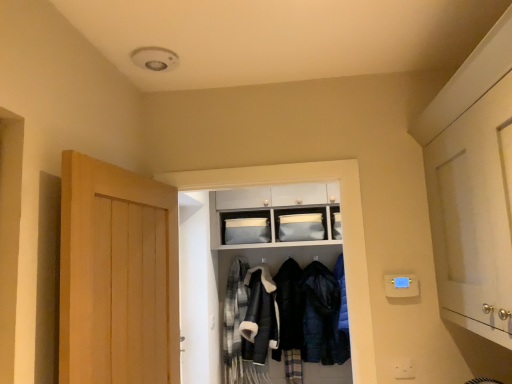
Question: Does light brown wooden door at left, the 2th door positioned from the right, appear on the left side of matte gray fabric storage at upper center?

Choices:
 (A) no
 (B) yes

Answer: (B)

Question: Is light brown wooden door at left, the first door when ordered from left to right, positioned behind matte gray fabric storage at upper center?

Choices:
 (A) no
 (B) yes

Answer: (A)

Question: Can you confirm if light brown wooden door at left, the 2th door positioned from the right, is bigger than matte gray fabric storage at upper center?

Choices:
 (A) yes
 (B) no

Answer: (A)

Question: Is light brown wooden door at left, the first door when ordered from left to right, thinner than matte gray fabric storage at upper center?

Choices:
 (A) yes
 (B) no

Answer: (B)

Question: Considering the relative sizes of light brown wooden door at left, the first door when ordered from left to right, and matte gray fabric storage at upper center in the image provided, is light brown wooden door at left, the first door when ordered from left to right, wider than matte gray fabric storage at upper center?

Choices:
 (A) no
 (B) yes

Answer: (B)

Question: Would you say light brown wooden door at left, the first door when ordered from left to right, is outside matte gray fabric storage at upper center?

Choices:
 (A) yes
 (B) no

Answer: (A)

Question: Would you say white glossy cabinet at right, placed as the 2th door when sorted from left to right, contains fluffy wool scarf at center, marked as the 4th clothing in a right-to-left arrangement?

Choices:
 (A) yes
 (B) no

Answer: (B)

Question: Considering the relative sizes of white glossy cabinet at right, placed as the 2th door when sorted from left to right, and fluffy wool scarf at center, marked as the 4th clothing in a right-to-left arrangement, in the image provided, is white glossy cabinet at right, placed as the 2th door when sorted from left to right, smaller than fluffy wool scarf at center, marked as the 4th clothing in a right-to-left arrangement,?

Choices:
 (A) no
 (B) yes

Answer: (A)

Question: From a real-world perspective, is white glossy cabinet at right, placed as the 2th door when sorted from left to right, over fluffy wool scarf at center, marked as the 4th clothing in a right-to-left arrangement?

Choices:
 (A) no
 (B) yes

Answer: (B)

Question: Does white glossy cabinet at right, positioned as the first door in right-to-left order, have a greater height compared to fluffy wool scarf at center, acting as the first clothing starting from the left?

Choices:
 (A) yes
 (B) no

Answer: (B)

Question: Can you confirm if white glossy cabinet at right, positioned as the first door in right-to-left order, is wider than fluffy wool scarf at center, marked as the 4th clothing in a right-to-left arrangement?

Choices:
 (A) yes
 (B) no

Answer: (A)

Question: Considering the relative sizes of white glossy cabinet at right, positioned as the first door in right-to-left order, and fluffy wool scarf at center, marked as the 4th clothing in a right-to-left arrangement, in the image provided, is white glossy cabinet at right, positioned as the first door in right-to-left order, thinner than fluffy wool scarf at center, marked as the 4th clothing in a right-to-left arrangement,?

Choices:
 (A) yes
 (B) no

Answer: (B)

Question: Is leather jacket at center, marked as the second clothing in a left-to-right arrangement, oriented away from matte gray fabric storage at upper center?

Choices:
 (A) yes
 (B) no

Answer: (B)